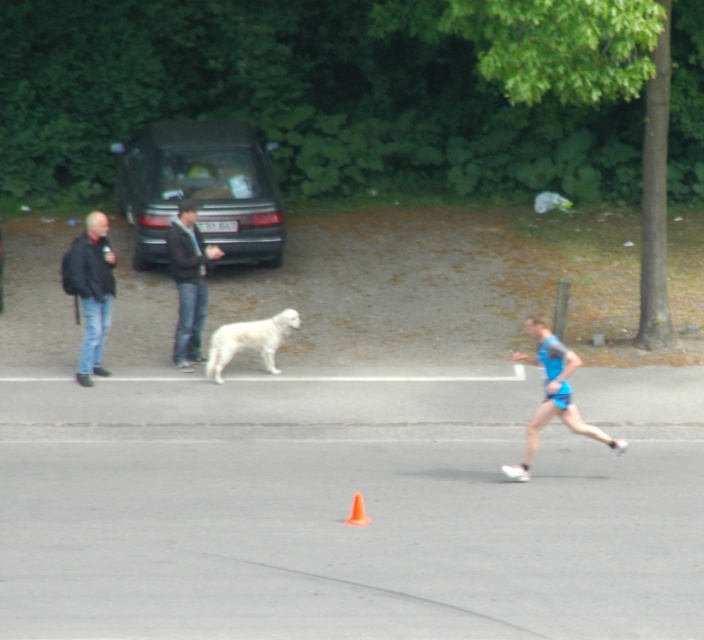
Can you confirm if blue fabric runner at center is smaller than orange plastic traffic cone at center?

Incorrect, blue fabric runner at center is not smaller in size than orange plastic traffic cone at center.

Who is more forward, (546, 369) or (353, 516)?

Point (353, 516) is in front.

What are the coordinates of `blue fabric runner at center` in the screenshot? It's located at (553, 396).

Is dark gray matte car at upper left to the right of orange plastic traffic cone at center from the viewer's perspective?

Incorrect, dark gray matte car at upper left is not on the right side of orange plastic traffic cone at center.

Is point (239, 147) in front of point (358, 499)?

No.

The image size is (704, 640). What are the coordinates of `dark gray matte car at upper left` in the screenshot? It's located at (201, 189).

Is dark blue jacket at left smaller than orange plastic traffic cone at center?

No.

Between dark blue jacket at left and orange plastic traffic cone at center, which one has less height?

orange plastic traffic cone at center

Is point (101, 268) farther from camera compared to point (360, 518)?

Yes.

Identify the location of dark blue jacket at left. (92, 291).